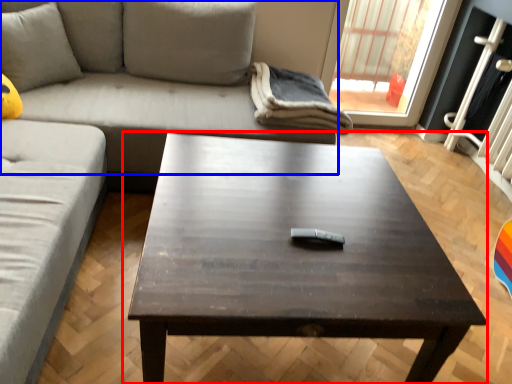
Question: Among these objects, which one is farthest to the camera, coffee table (highlighted by a red box) or studio couch (highlighted by a blue box)?

Choices:
 (A) coffee table
 (B) studio couch

Answer: (B)